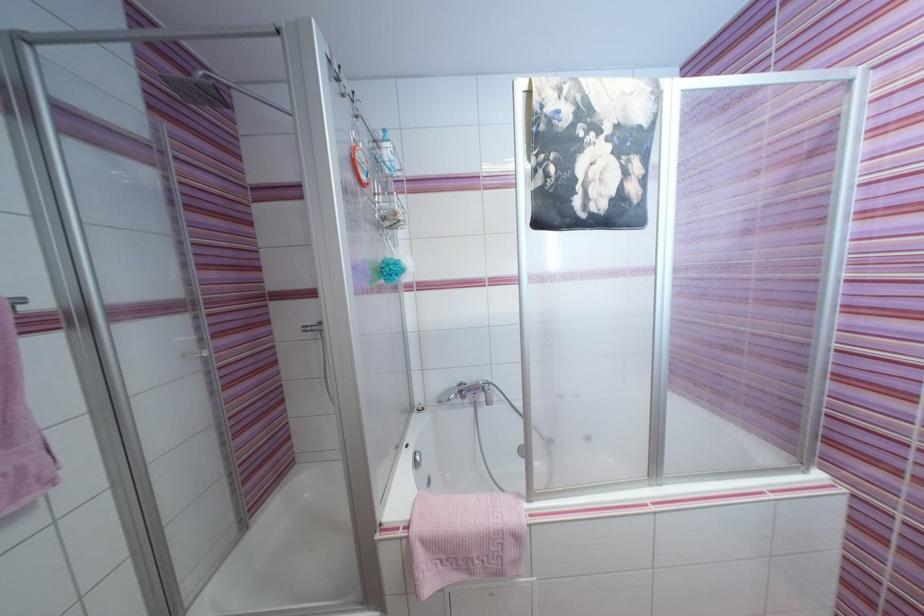
Where would you lift the purple mesh sponge? Please return your answer as a coordinate pair (x, y).

(19, 429)